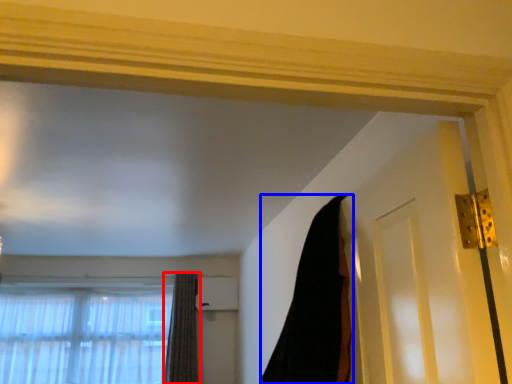
Question: Which object is closer to the camera taking this photo, curtain (highlighted by a red box) or curtain (highlighted by a blue box)?

Choices:
 (A) curtain
 (B) curtain

Answer: (B)